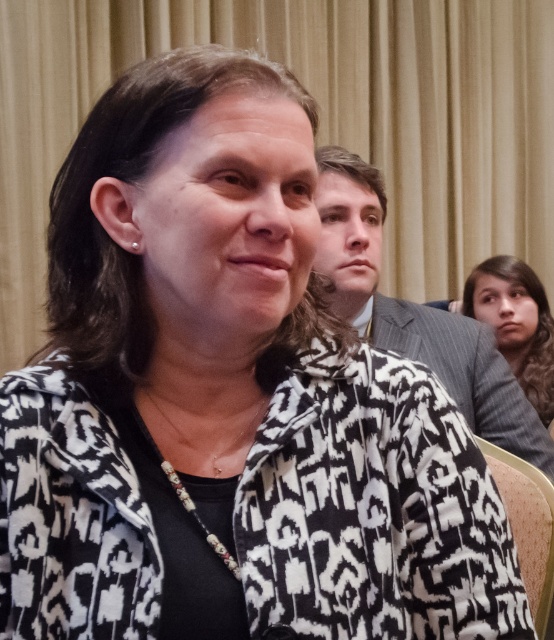
Based on the scene description, which object is positioned lower in the image between the black and white patterned jacket at center and the gray wool sweater at lower right?

The black and white patterned jacket at center is positioned lower than the gray wool sweater at lower right in the image.

You are a photographer setting up for a group photo. You need to arrange the subjects so that the gray suit jacket at upper center and the gray wool sweater at lower right are visible. Considering their sizes, which clothing item should you position closer to the camera to ensure both are fully visible in the frame?

The gray suit jacket at upper center is wider than the gray wool sweater at lower right. To ensure both are fully visible, position the gray suit jacket at upper center closer to the camera so its wider width doesn